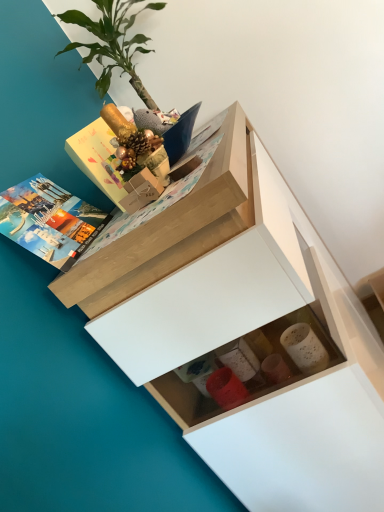
Question: Considering the relative sizes of green leafy plant at upper left and matte hardcover book at upper left in the image provided, is green leafy plant at upper left smaller than matte hardcover book at upper left?

Choices:
 (A) no
 (B) yes

Answer: (A)

Question: Does green leafy plant at upper left have a lesser width compared to matte hardcover book at upper left?

Choices:
 (A) no
 (B) yes

Answer: (A)

Question: Considering the relative sizes of green leafy plant at upper left and matte hardcover book at upper left in the image provided, is green leafy plant at upper left wider than matte hardcover book at upper left?

Choices:
 (A) no
 (B) yes

Answer: (B)

Question: From a real-world perspective, is green leafy plant at upper left physically above matte hardcover book at upper left?

Choices:
 (A) yes
 (B) no

Answer: (A)

Question: From the image's perspective, would you say green leafy plant at upper left is positioned over matte hardcover book at upper left?

Choices:
 (A) yes
 (B) no

Answer: (A)

Question: Can you confirm if green leafy plant at upper left is positioned to the right of matte hardcover book at upper left?

Choices:
 (A) no
 (B) yes

Answer: (B)

Question: Is white matte chest of drawers at upper center outside green leafy plant at upper left?

Choices:
 (A) no
 (B) yes

Answer: (B)

Question: Is white matte chest of drawers at upper center thinner than green leafy plant at upper left?

Choices:
 (A) yes
 (B) no

Answer: (B)

Question: From the image's perspective, is white matte chest of drawers at upper center below green leafy plant at upper left?

Choices:
 (A) yes
 (B) no

Answer: (A)

Question: Considering the relative sizes of white matte chest of drawers at upper center and green leafy plant at upper left in the image provided, is white matte chest of drawers at upper center bigger than green leafy plant at upper left?

Choices:
 (A) no
 (B) yes

Answer: (B)

Question: Considering the relative sizes of white matte chest of drawers at upper center and green leafy plant at upper left in the image provided, is white matte chest of drawers at upper center taller than green leafy plant at upper left?

Choices:
 (A) yes
 (B) no

Answer: (A)

Question: Is white matte chest of drawers at upper center touching green leafy plant at upper left?

Choices:
 (A) no
 (B) yes

Answer: (A)

Question: Does matte hardcover book at upper left appear on the left side of white matte chest of drawers at upper center?

Choices:
 (A) yes
 (B) no

Answer: (A)